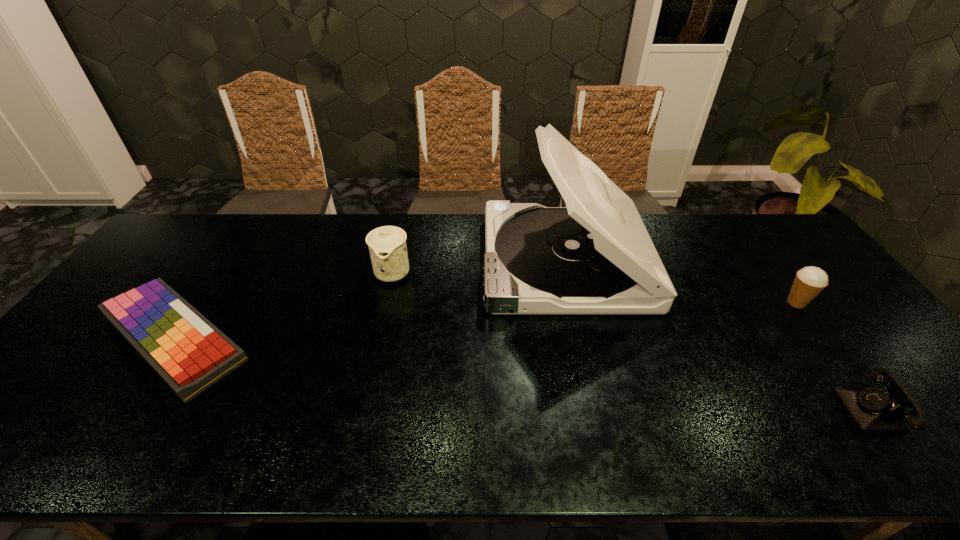
Where is `vacant space situated on the control panel of the third object from left to right`? vacant space situated on the control panel of the third object from left to right is located at coordinates (363, 261).

At what (x,y) coordinates should I click in order to perform the action: click on vacant space located 0.290m on the spout of the fourth shortest object. Please return your answer as a coordinate pair (x, y). This screenshot has width=960, height=540. Looking at the image, I should click on (371, 373).

You are a GUI agent. You are given a task and a screenshot of the screen. Output one action in this format:
    pyautogui.click(x=<x>, y=<y>)
    Task: Click on the vacant space located on the front of the icecream
    The width and height of the screenshot is (960, 540).
    Given the screenshot: What is the action you would take?
    pyautogui.click(x=838, y=359)

Locate an element on the screen. This screenshot has width=960, height=540. vacant space located 0.090m on the front face of the telephone is located at coordinates 798,401.

The image size is (960, 540). I want to click on vacant position located 0.050m on the front face of the telephone, so click(x=815, y=401).

Locate an element on the screen. The image size is (960, 540). blank space located 0.220m on the front face of the telephone is located at coordinates (741, 401).

In order to click on free spot located 0.380m on the right of the computer keyboard in this screenshot , I will do point(403,338).

You are a GUI agent. You are given a task and a screenshot of the screen. Output one action in this format:
    pyautogui.click(x=<x>, y=<y>)
    Task: Click on the CD player present at the far edge
    Image resolution: width=960 pixels, height=540 pixels.
    Given the screenshot: What is the action you would take?
    pyautogui.click(x=595, y=256)

Image resolution: width=960 pixels, height=540 pixels. I want to click on chinaware at the far edge, so click(x=387, y=245).

Where is `object at the near edge`? The image size is (960, 540). object at the near edge is located at coordinates (872, 410).